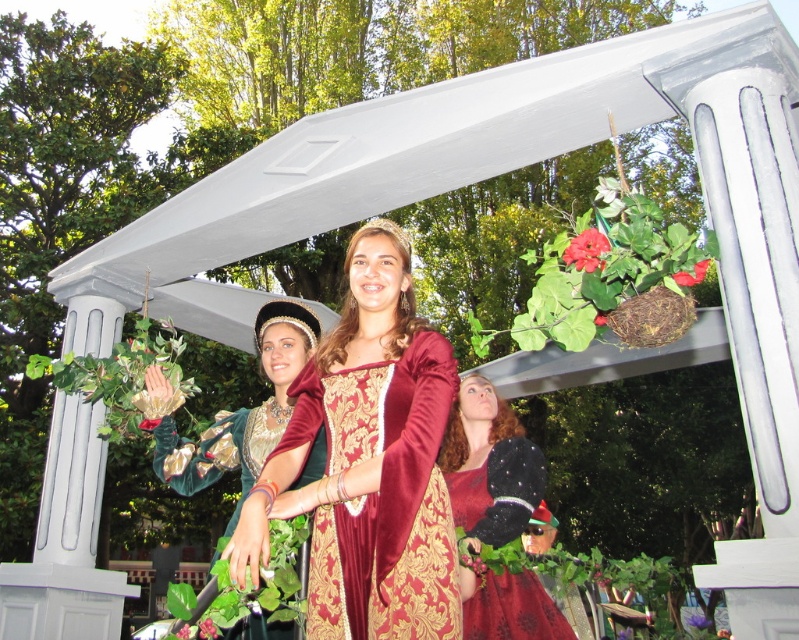
Question: Which object appears farthest from the camera in this image?

Choices:
 (A) red matte flower at upper center
 (B) red matte flower at upper right

Answer: (A)

Question: Which object appears farthest from the camera in this image?

Choices:
 (A) velvet gold dress at center
 (B) pink matte flower at center

Answer: (B)

Question: Is purple matte flower at upper center positioned at the back of pink matte flower at center?

Choices:
 (A) yes
 (B) no

Answer: (A)

Question: Does vivid red petal at upper center have a smaller size compared to red matte flower at center?

Choices:
 (A) no
 (B) yes

Answer: (B)

Question: Which of these objects is positioned farthest from the green leafy plant at center?

Choices:
 (A) velvet gold dress at center
 (B) red matte flower at upper right
 (C) velvet/goldenobject at center
 (D) red matte flower at center

Answer: (B)

Question: Is velvet gold dress at center above red matte flower at upper right?

Choices:
 (A) no
 (B) yes

Answer: (A)